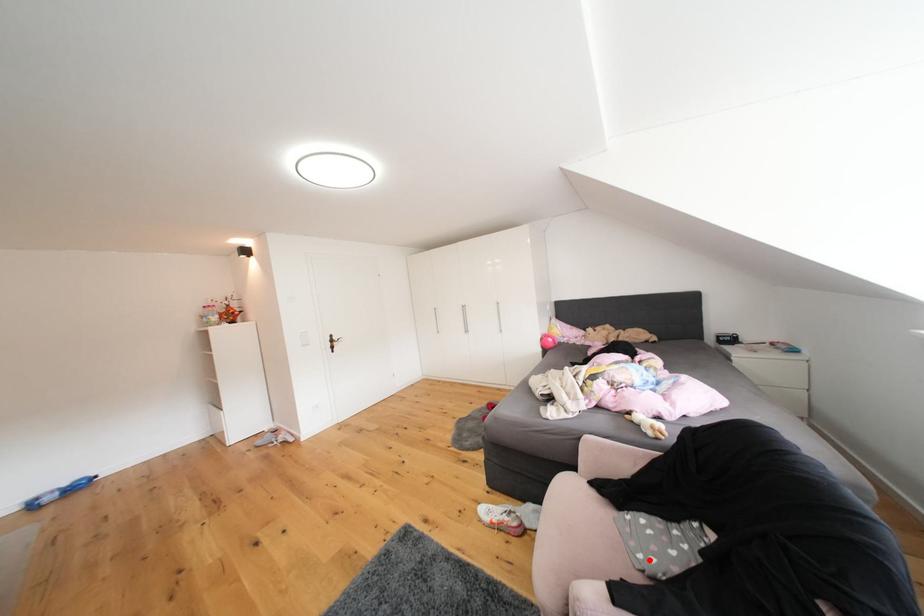
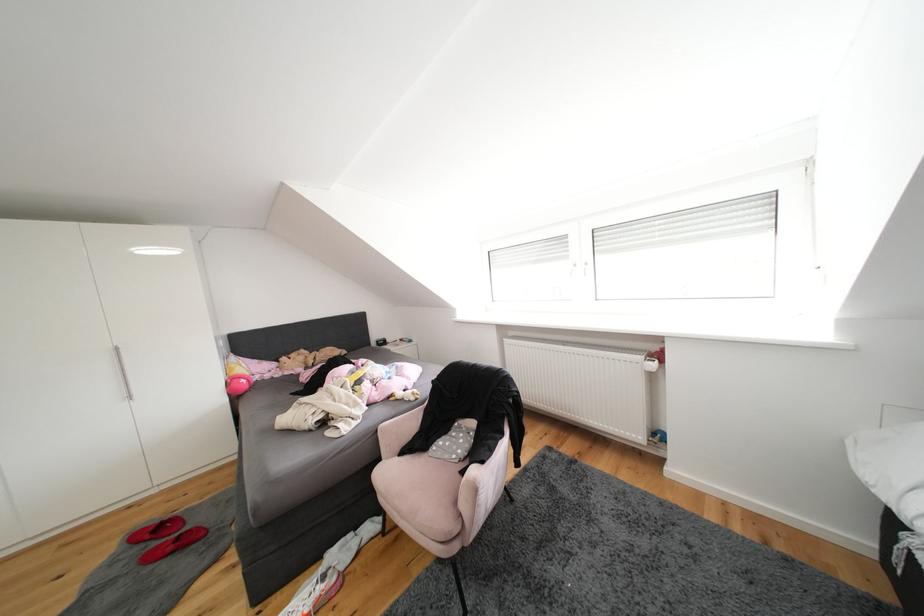
The point at the highlighted location is marked in the first image. Where is the corresponding point in the second image?

(464, 460)